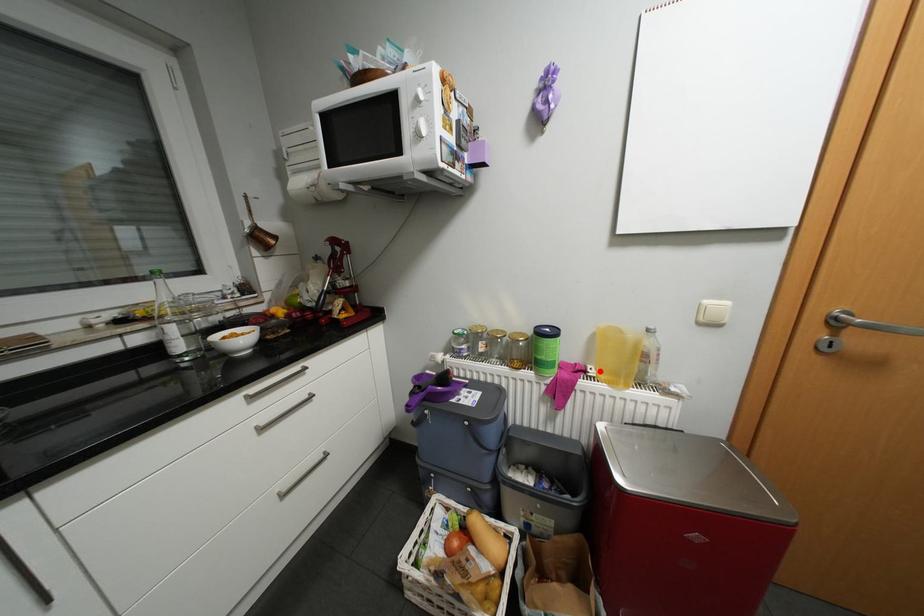
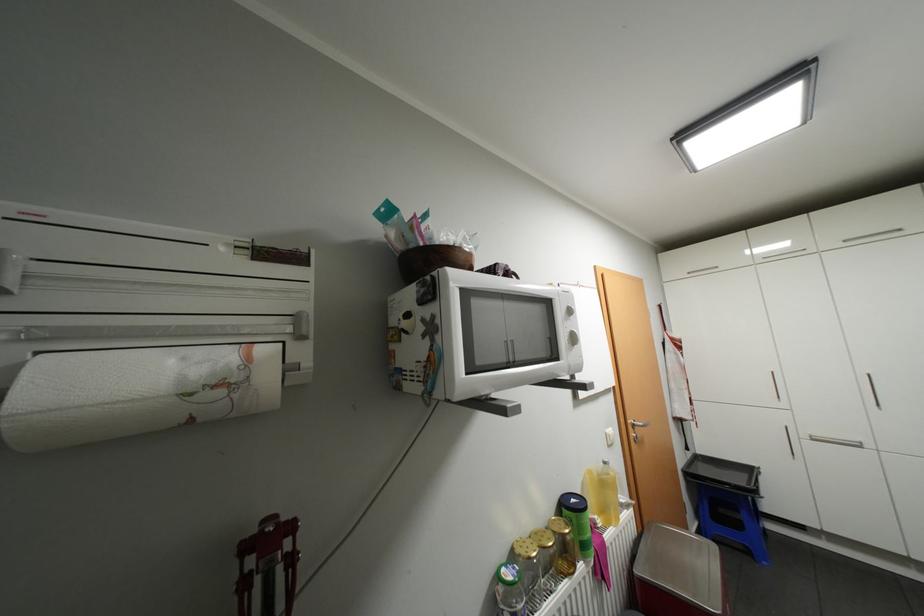
Find the pixel in the second image that matches the highlighted location in the first image.

(606, 521)